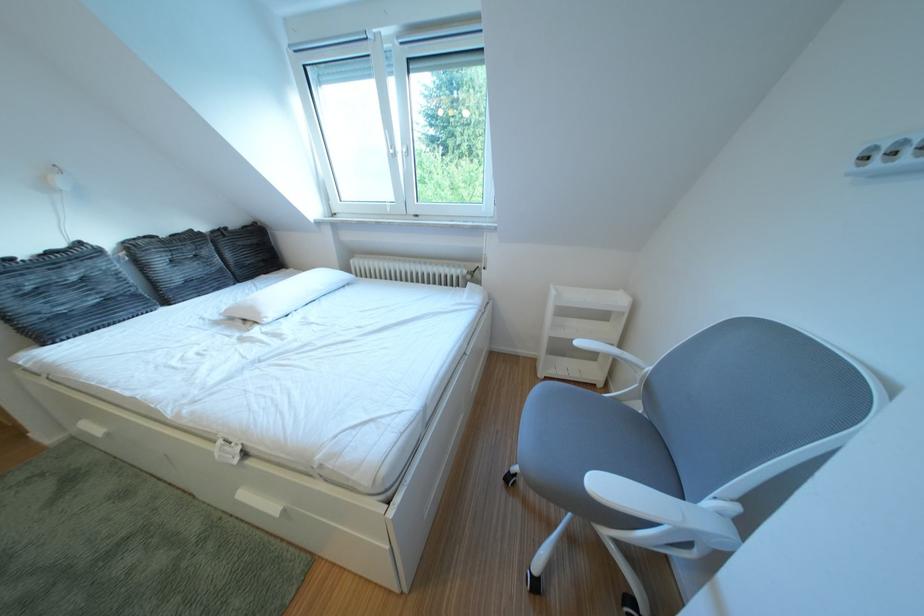
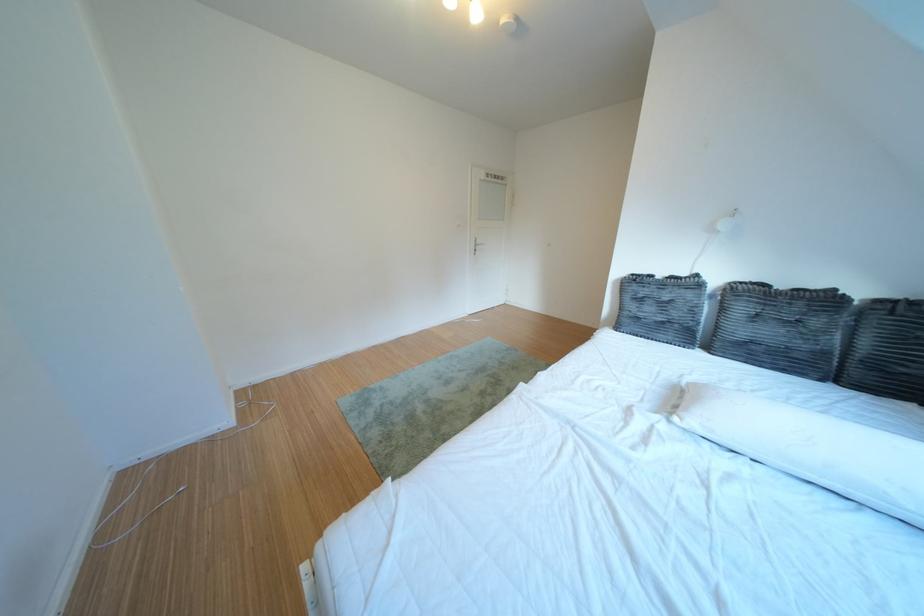
Where in the second image is the point corresponding to [46,325] from the first image?

(639, 318)